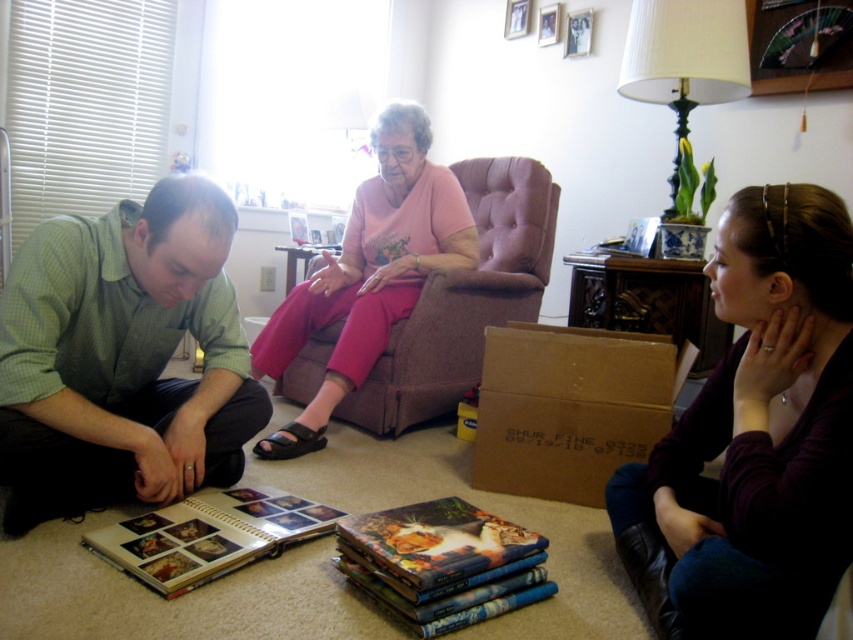
Question: Which point is closer to the camera?

Choices:
 (A) (149, 372)
 (B) (544, 364)

Answer: (A)

Question: Can you confirm if maroon sweater at lower right is bigger than brown cardboard box at lower center?

Choices:
 (A) yes
 (B) no

Answer: (A)

Question: Which of the following is the closest to the observer?

Choices:
 (A) green checkered shirt at lower left
 (B) maroon sweater at lower right
 (C) hardcover book at center

Answer: (B)

Question: In this image, where is green checkered shirt at lower left located relative to matte paper photo album at lower left?

Choices:
 (A) right
 (B) left

Answer: (B)

Question: Does green checkered shirt at lower left appear under pink fabric chair at center?

Choices:
 (A) no
 (B) yes

Answer: (B)

Question: Among these objects, which one is farthest from the camera?

Choices:
 (A) brown cardboard box at lower center
 (B) pink fabric chair at center

Answer: (B)